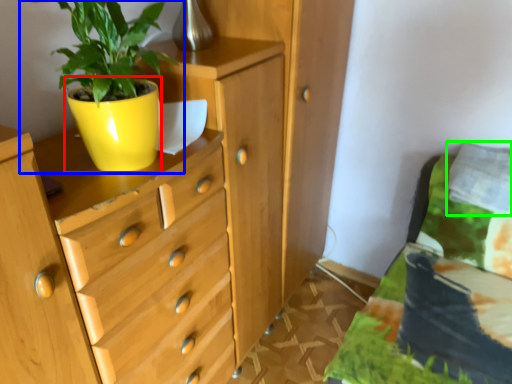
Question: Considering the real-world distances, which object is farthest from flowerpot (highlighted by a red box)? houseplant (highlighted by a blue box) or pillow (highlighted by a green box)?

Choices:
 (A) houseplant
 (B) pillow

Answer: (B)